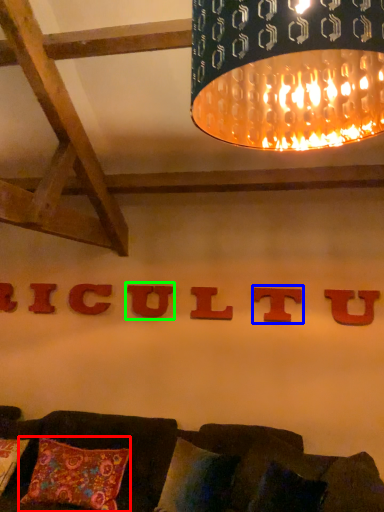
Question: Which object is the farthest from pillow (highlighted by a red box)? Choose among these: alphabet (highlighted by a blue box) or alphabet (highlighted by a green box).

Choices:
 (A) alphabet
 (B) alphabet

Answer: (A)